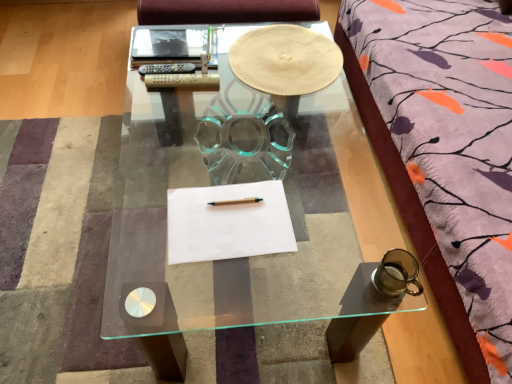
At what (x,y) coordinates should I click in order to perform the action: click on free spot above white paper at center, which is the first notebook from bottom to top (from a real-world perspective). Please return your answer as a coordinate pair (x, y). Image resolution: width=512 pixels, height=384 pixels. Looking at the image, I should click on (226, 214).